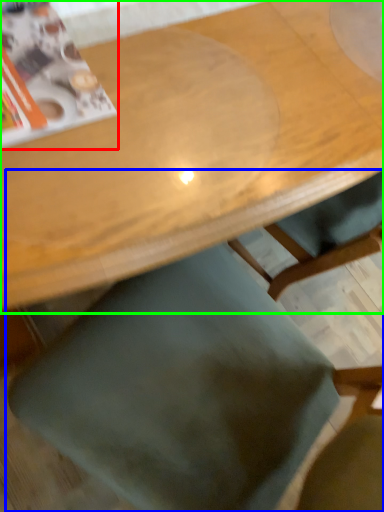
Question: Which is nearer to the magazine (highlighted by a red box)? chair (highlighted by a blue box) or table (highlighted by a green box).

Choices:
 (A) chair
 (B) table

Answer: (B)